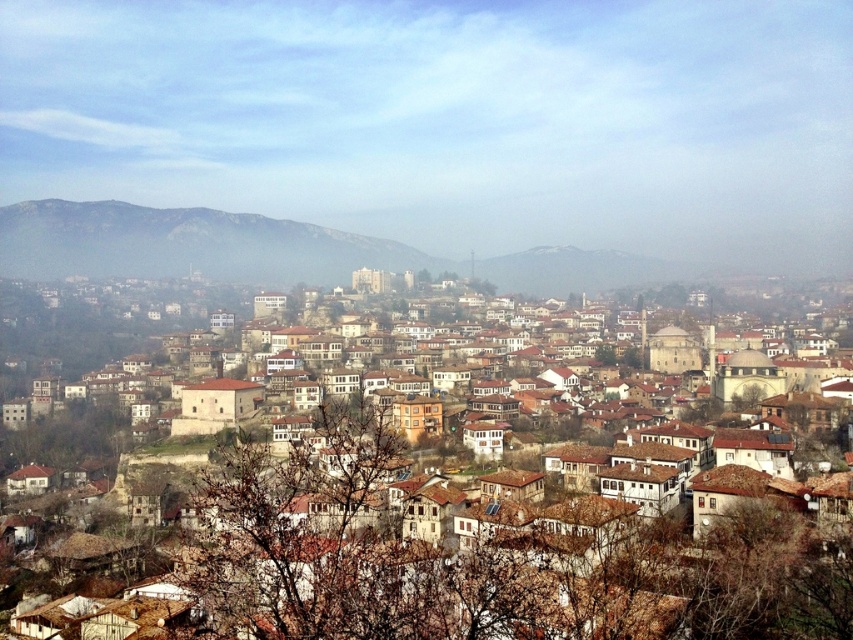
You are standing in the urban area and want to take a photo of the brown stone buildings at center and the rocky brown hillside at left. Which object will appear larger in the photo?

The brown stone buildings at center will appear larger in the photo because they are closer to the viewer than the rocky brown hillside at left.

In the scene shown: You are a hiker planning to take a photo of the brown stone buildings at center and the rocky brown hillside at left. Based on their positions, which object is closer to the camera?

The brown stone buildings at center are closer to the camera than the rocky brown hillside at left because they are positioned under it.

You are standing at the origin point of the coordinate system in the image. Looking at the scene, where is the brown stone buildings at center located in terms of their 2D coordinates?

The brown stone buildings at center are located at coordinates point (x=508, y=564).